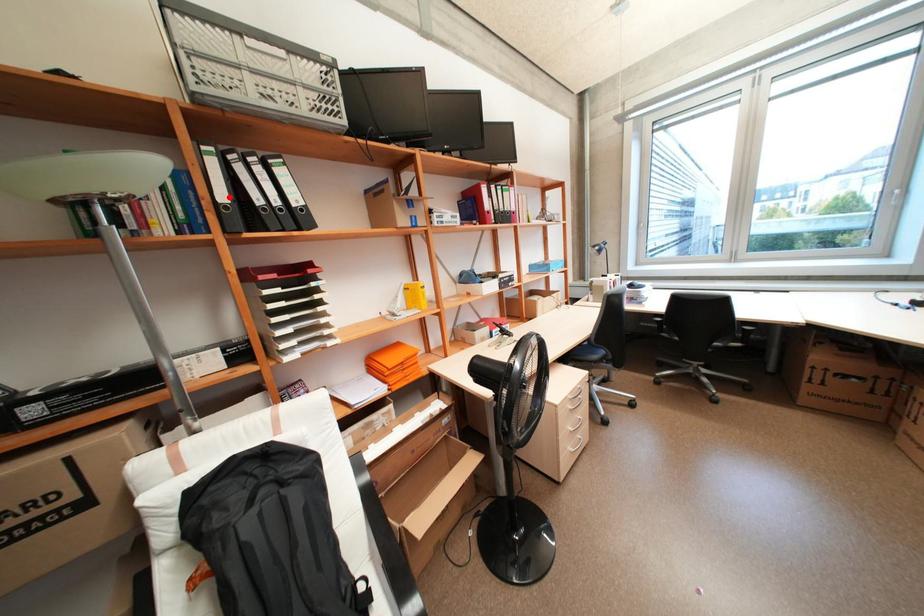
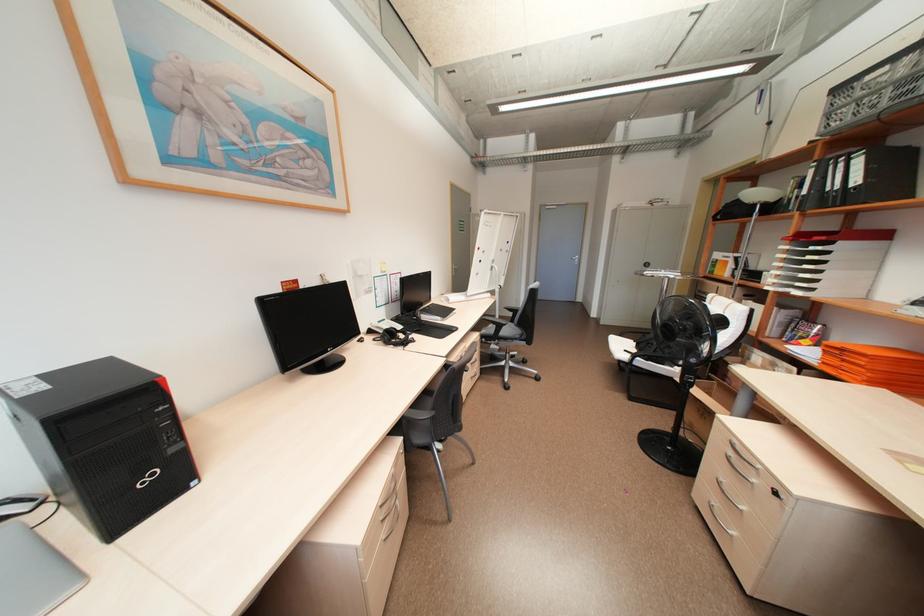
Find the pixel in the second image that matches the highlighted location in the first image.

(810, 191)